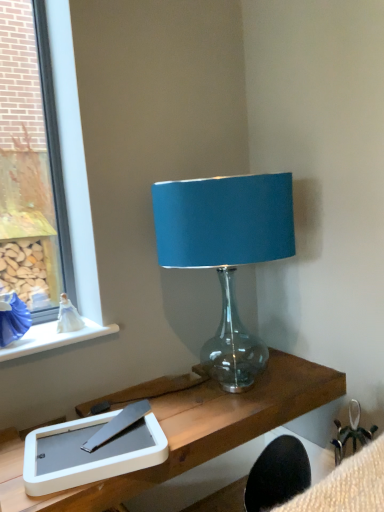
This screenshot has width=384, height=512. Describe the element at coordinates (226, 252) in the screenshot. I see `teal fabric lampshade at upper center` at that location.

What do you see at coordinates (89, 453) in the screenshot?
I see `white matte tablet at lower left` at bounding box center [89, 453].

What do you see at coordinates (69, 199) in the screenshot?
I see `clear glass window at left` at bounding box center [69, 199].

Find the location of `teal fabric lampshade at upper center`. teal fabric lampshade at upper center is located at coordinates (226, 252).

Looking at this image, which of these two, white matte tablet at lower left or white ceramic window sill at upper left, is smaller?

white ceramic window sill at upper left.

Is white ceramic window sill at upper left located within white matte tablet at lower left?

No, white ceramic window sill at upper left is located outside of white matte tablet at lower left.

In the image, is white matte tablet at lower left positioned in front of or behind white ceramic window sill at upper left?

white matte tablet at lower left is in front of white ceramic window sill at upper left.

Considering the relative sizes of white matte tablet at lower left and white ceramic window sill at upper left in the image provided, is white matte tablet at lower left wider than white ceramic window sill at upper left?

Indeed, white matte tablet at lower left has a greater width compared to white ceramic window sill at upper left.

Is white ceramic window sill at upper left not inside clear glass window at left?

white ceramic window sill at upper left lies outside clear glass window at left's area.

In the scene shown: Measure the distance between white ceramic window sill at upper left and clear glass window at left.

white ceramic window sill at upper left is 9.47 inches from clear glass window at left.

Identify the location of window that is above the white ceramic window sill at upper left (from the image's perspective). This screenshot has height=512, width=384. (69, 199).

From the image's perspective, is white ceramic window sill at upper left above clear glass window at left?

Incorrect, from the image's perspective, white ceramic window sill at upper left is lower than clear glass window at left.

From the image's perspective, is teal fabric lampshade at upper center located above or below white matte tablet at lower left?

From the image's perspective, teal fabric lampshade at upper center appears above white matte tablet at lower left.

Can you confirm if teal fabric lampshade at upper center is positioned to the left of white matte tablet at lower left?

In fact, teal fabric lampshade at upper center is to the right of white matte tablet at lower left.

Consider the image. Is teal fabric lampshade at upper center situated inside white matte tablet at lower left or outside?

teal fabric lampshade at upper center is not enclosed by white matte tablet at lower left.

How distant is teal fabric lampshade at upper center from white ceramic window sill at upper left?

19.25 inches.

Which point is more distant from viewer, (266, 227) or (82, 335)?

The point (82, 335) is more distant.

Considering the positions of objects teal fabric lampshade at upper center and white ceramic window sill at upper left in the image provided, who is more to the right, teal fabric lampshade at upper center or white ceramic window sill at upper left?

From the viewer's perspective, teal fabric lampshade at upper center appears more on the right side.

Which object is wider, teal fabric lampshade at upper center or white ceramic window sill at upper left?

teal fabric lampshade at upper center.

Are clear glass window at left and white ceramic window sill at upper left far apart?

No, there isn't a large distance between clear glass window at left and white ceramic window sill at upper left.

Is clear glass window at left not inside white ceramic window sill at upper left?

Yes, clear glass window at left is not within white ceramic window sill at upper left.

Can you confirm if clear glass window at left is shorter than white ceramic window sill at upper left?

In fact, clear glass window at left may be taller than white ceramic window sill at upper left.

Which of these two, clear glass window at left or white ceramic window sill at upper left, is smaller?

With smaller size is white ceramic window sill at upper left.

From a real-world perspective, which object rests below the other?

From a 3D spatial view, white matte tablet at lower left is below.

Which of these two, white matte tablet at lower left or clear glass window at left, stands taller?

With more height is clear glass window at left.

In the image, is white matte tablet at lower left positioned in front of or behind clear glass window at left?

In the image, white matte tablet at lower left appears in front of clear glass window at left.

Image resolution: width=384 pixels, height=512 pixels. I want to click on tablet computer that is below the clear glass window at left (from the image's perspective), so click(x=89, y=453).

Between white matte tablet at lower left and teal fabric lampshade at upper center, which one has smaller size?

white matte tablet at lower left is smaller.

Would you consider white matte tablet at lower left to be distant from teal fabric lampshade at upper center?

white matte tablet at lower left is near teal fabric lampshade at upper center, not far away.

From a real-world perspective, which is physically below, white matte tablet at lower left or teal fabric lampshade at upper center?

white matte tablet at lower left.

Does white matte tablet at lower left turn towards teal fabric lampshade at upper center?

No.

Where is `tablet computer on the right of white ceramic window sill at upper left`? tablet computer on the right of white ceramic window sill at upper left is located at coordinates (89, 453).

Find the location of `window above the white ceramic window sill at upper left (from a real-world perspective)`. window above the white ceramic window sill at upper left (from a real-world perspective) is located at coordinates (69, 199).

Based on their spatial positions, is clear glass window at left or teal fabric lampshade at upper center further from white ceramic window sill at upper left?

teal fabric lampshade at upper center.

Consider the image. Estimate the real-world distances between objects in this image. Which object is further from clear glass window at left, teal fabric lampshade at upper center or white matte tablet at lower left?

white matte tablet at lower left lies further to clear glass window at left than the other object.

Consider the image. Based on their spatial positions, is teal fabric lampshade at upper center or clear glass window at left closer to white matte tablet at lower left?

clear glass window at left lies closer to white matte tablet at lower left than the other object.

When comparing their distances from clear glass window at left, does white matte tablet at lower left or white ceramic window sill at upper left seem further?

white matte tablet at lower left is further to clear glass window at left.

Which object lies nearer to the anchor point white ceramic window sill at upper left, clear glass window at left or white matte tablet at lower left?

clear glass window at left.

Based on their spatial positions, is teal fabric lampshade at upper center or white ceramic window sill at upper left closer to white matte tablet at lower left?

white ceramic window sill at upper left is positioned closer to the anchor white matte tablet at lower left.

From the picture: Which object lies further to the anchor point clear glass window at left, teal fabric lampshade at upper center or white ceramic window sill at upper left?

teal fabric lampshade at upper center lies further to clear glass window at left than the other object.

Based on their spatial positions, is teal fabric lampshade at upper center or white matte tablet at lower left closer to white ceramic window sill at upper left?

Among the two, white matte tablet at lower left is located nearer to white ceramic window sill at upper left.

Locate an element on the screen. The width and height of the screenshot is (384, 512). window sill between clear glass window at left and teal fabric lampshade at upper center in the horizontal direction is located at coordinates (53, 338).

Where is `window sill between clear glass window at left and white matte tablet at lower left in the up-down direction`? window sill between clear glass window at left and white matte tablet at lower left in the up-down direction is located at coordinates (53, 338).

Locate an element on the screen. tablet computer between white ceramic window sill at upper left and teal fabric lampshade at upper center in the horizontal direction is located at coordinates 89,453.

Identify the location of lamp between clear glass window at left and white matte tablet at lower left in the vertical direction. The width and height of the screenshot is (384, 512). (226, 252).